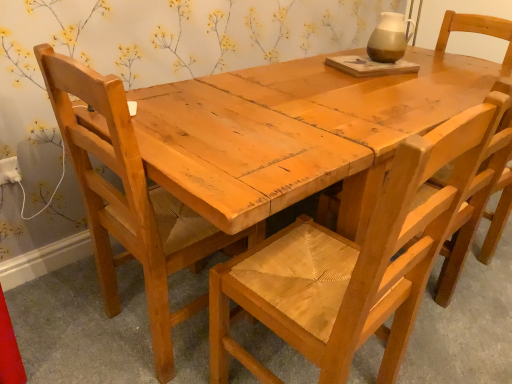
Locate an element on the screen. vacant area situated below natural wood chair at left, marked as the third chair in a right-to-left arrangement (from a real-world perspective) is located at coordinates (170, 325).